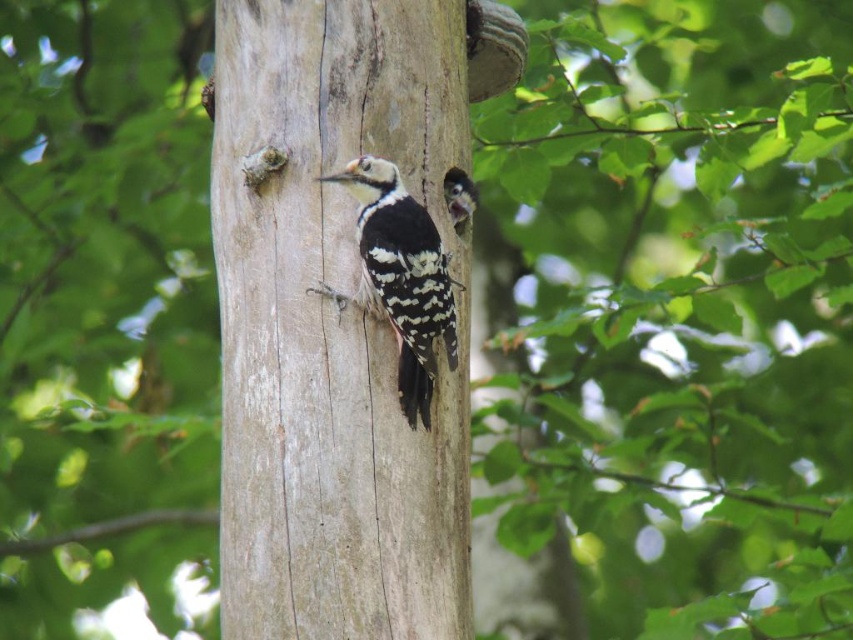
Question: Is smooth gray wood at center closer to the viewer compared to white speckled woodpecker at center?

Choices:
 (A) no
 (B) yes

Answer: (B)

Question: Which point is farther to the camera?

Choices:
 (A) (444, 372)
 (B) (381, 272)

Answer: (A)

Question: Is smooth gray wood at center bigger than white speckled woodpecker at center?

Choices:
 (A) no
 (B) yes

Answer: (B)

Question: Is smooth gray wood at center to the left of white speckled woodpecker at center from the viewer's perspective?

Choices:
 (A) no
 (B) yes

Answer: (B)